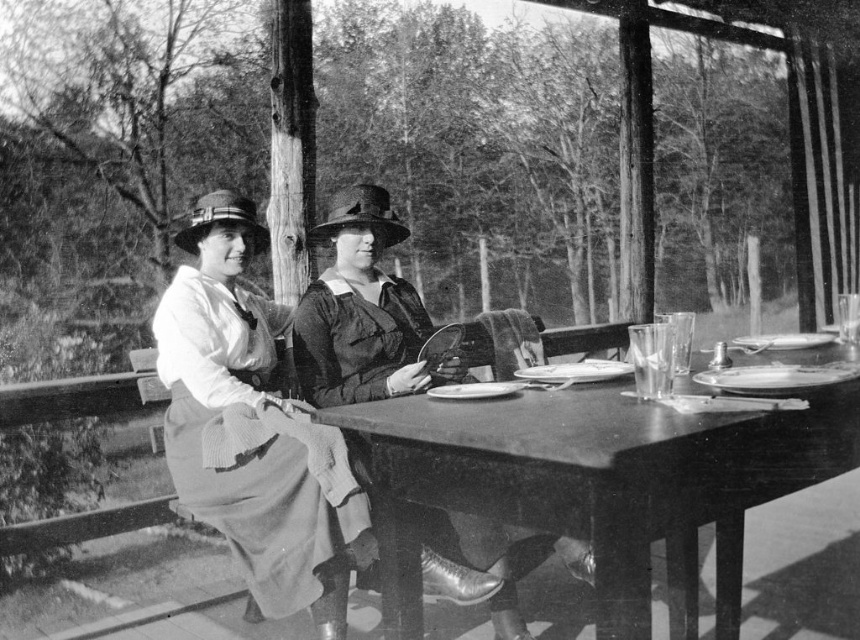
Question: Which point is farther from the camera taking this photo?

Choices:
 (A) (336, 515)
 (B) (404, 408)
 (C) (495, 609)

Answer: (C)

Question: In this image, where is wooden table at center located relative to matte black dress at center?

Choices:
 (A) left
 (B) right

Answer: (B)

Question: Which point is closer to the camera?

Choices:
 (A) (494, 467)
 (B) (345, 275)
 (C) (183, 406)

Answer: (A)

Question: Which object is the closest to the matte white blouse at center?

Choices:
 (A) wooden table at center
 (B) matte black dress at center

Answer: (B)

Question: Is matte white blouse at center behind matte black dress at center?

Choices:
 (A) yes
 (B) no

Answer: (B)

Question: Is wooden table at center positioned behind matte white blouse at center?

Choices:
 (A) no
 (B) yes

Answer: (A)